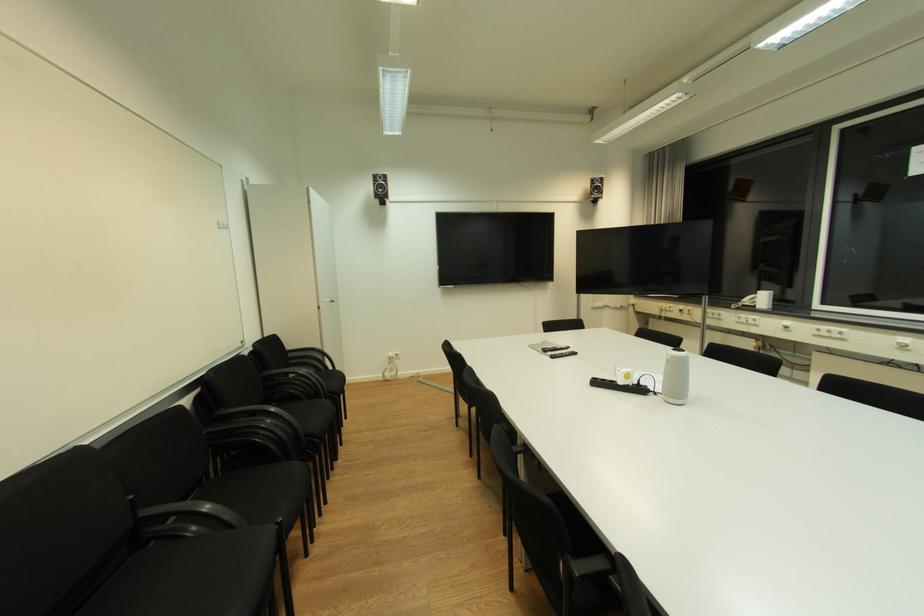
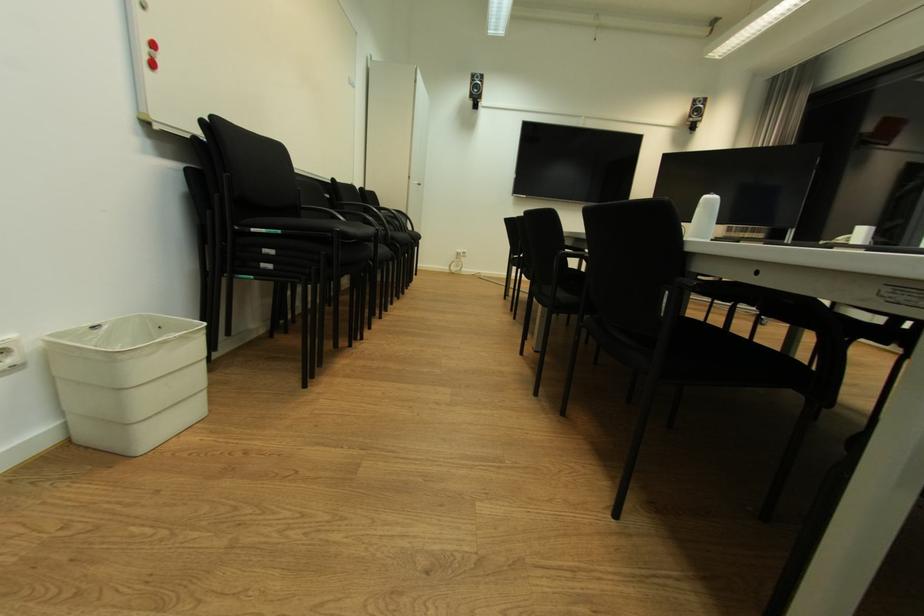
Question: How did the camera likely rotate?

Choices:
 (A) Left
 (B) Right
 (C) Up
 (D) Down

Answer: (A)